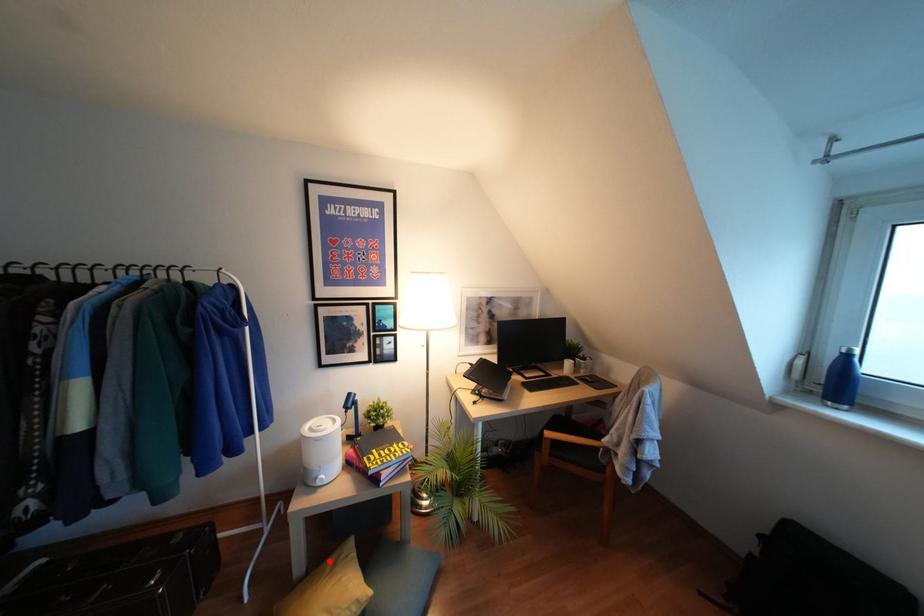
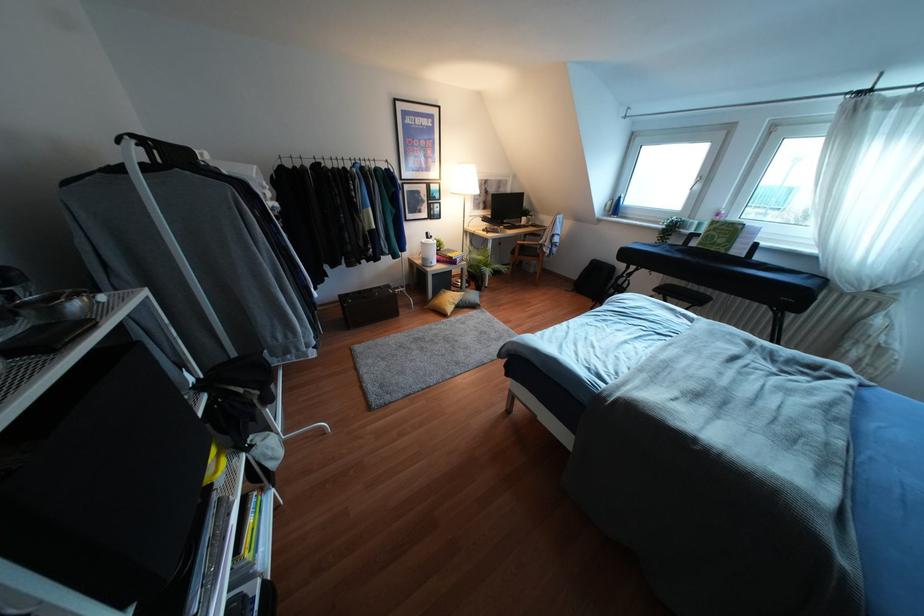
Question: A red point is marked in image1. In image2, is the corresponding 3D point closer to the camera or farther? Reply with the corresponding letter.

Choices:
 (A) The corresponding 3D point is closer.
 (B) The corresponding 3D point is farther.

Answer: (A)